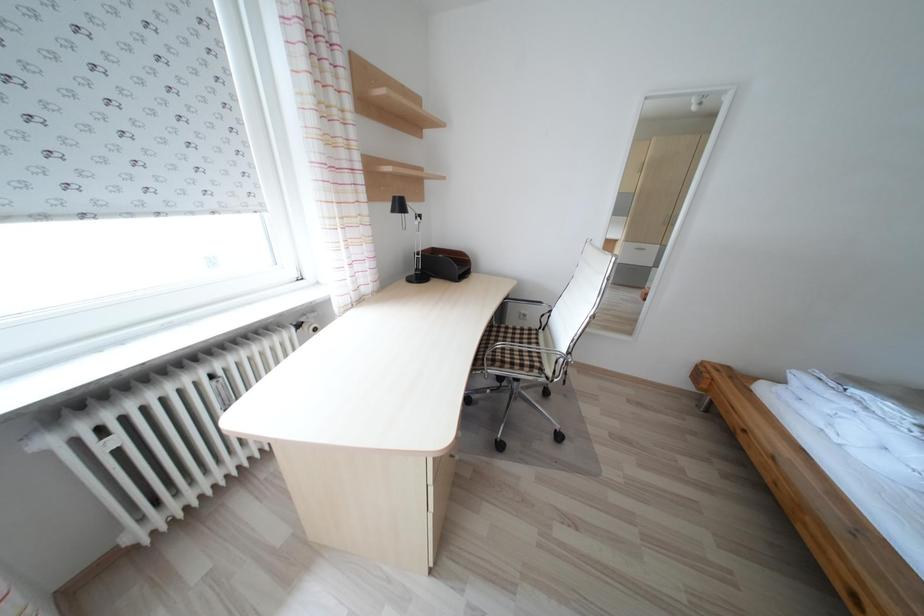
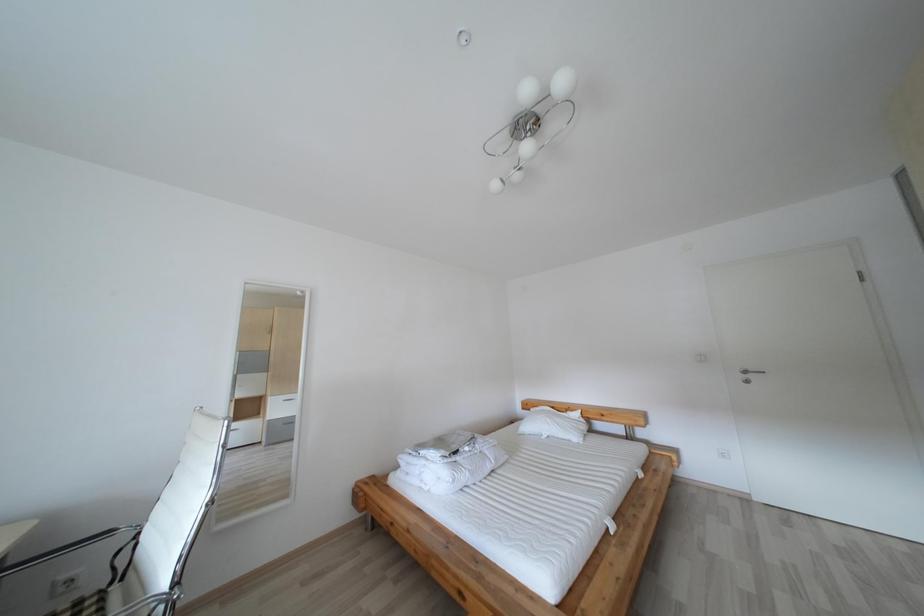
Based on the continuous images, in which direction is the camera rotating?

The camera rotated toward right-up.